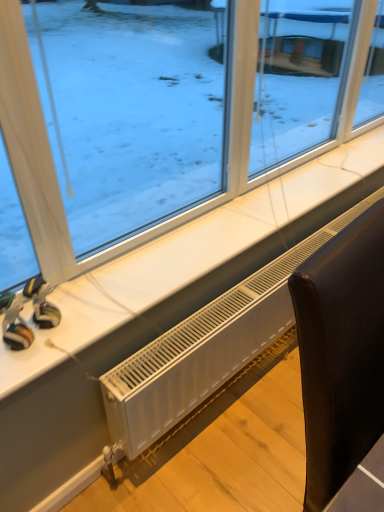
The height and width of the screenshot is (512, 384). What are the coordinates of `free point in front of rubberized plastic toy at lower left, the second toy in the right-to-left sequence` in the screenshot? It's located at (16, 369).